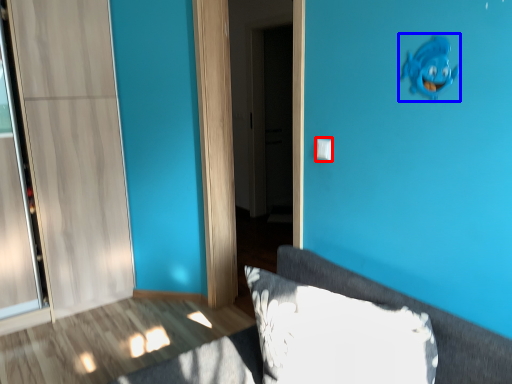
Question: Which object is further to the camera taking this photo, light switch (highlighted by a red box) or animal (highlighted by a blue box)?

Choices:
 (A) light switch
 (B) animal

Answer: (A)